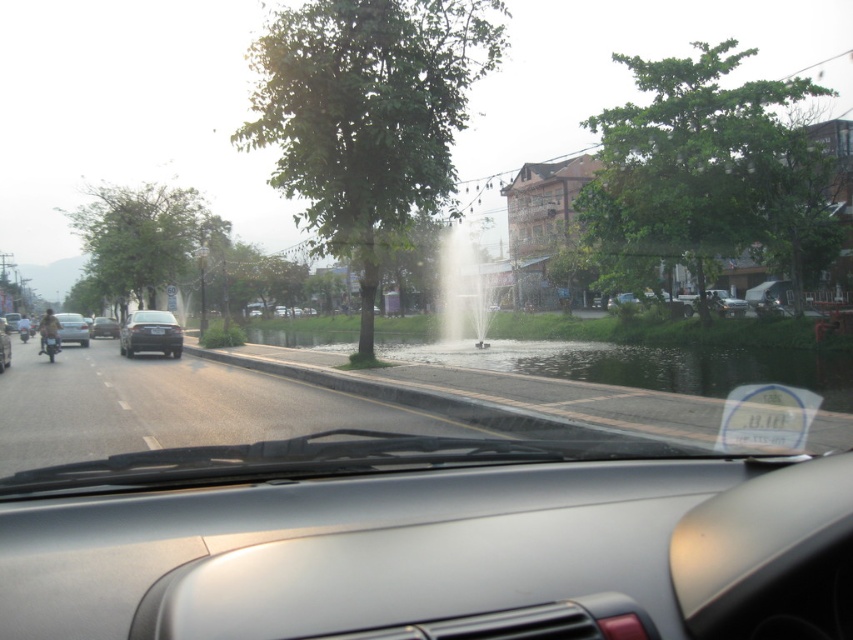
Find the location of `black matte car at center`. black matte car at center is located at coordinates (149, 333).

Can you confirm if black matte car at center is smaller than metallic silver motorcycle at left?

Incorrect, black matte car at center is not smaller in size than metallic silver motorcycle at left.

Which is in front, point (178, 356) or point (57, 344)?

Point (57, 344) is more forward.

Find the location of a particular element. The height and width of the screenshot is (640, 853). black matte car at center is located at coordinates (149, 333).

Which of these two, black matte car at center or matte black car at left, stands shorter?

Standing shorter between the two is black matte car at center.

Does black matte car at center lie behind matte black car at left?

That is True.

You are a GUI agent. You are given a task and a screenshot of the screen. Output one action in this format:
    pyautogui.click(x=<x>, y=<y>)
    Task: Click on the black matte car at center
    
    Given the screenshot: What is the action you would take?
    pyautogui.click(x=149, y=333)

Is satin black sedan at left positioned in front of matte black car at left?

No, satin black sedan at left is further to the viewer.

Who is more distant from viewer, (115, 321) or (4, 355)?

Positioned behind is point (115, 321).

At what (x,y) coordinates should I click in order to perform the action: click on satin black sedan at left. Please return your answer as a coordinate pair (x, y). Looking at the image, I should click on (103, 326).